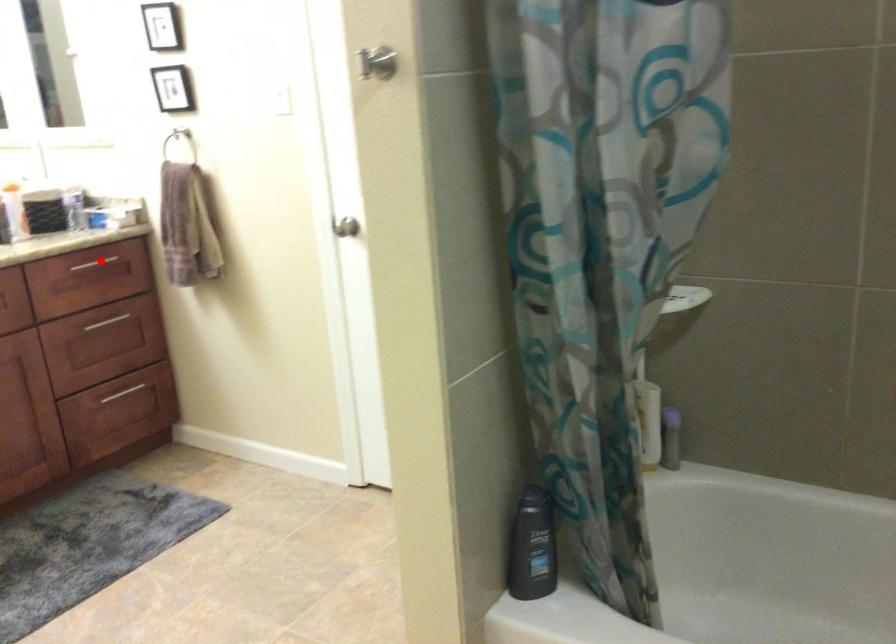
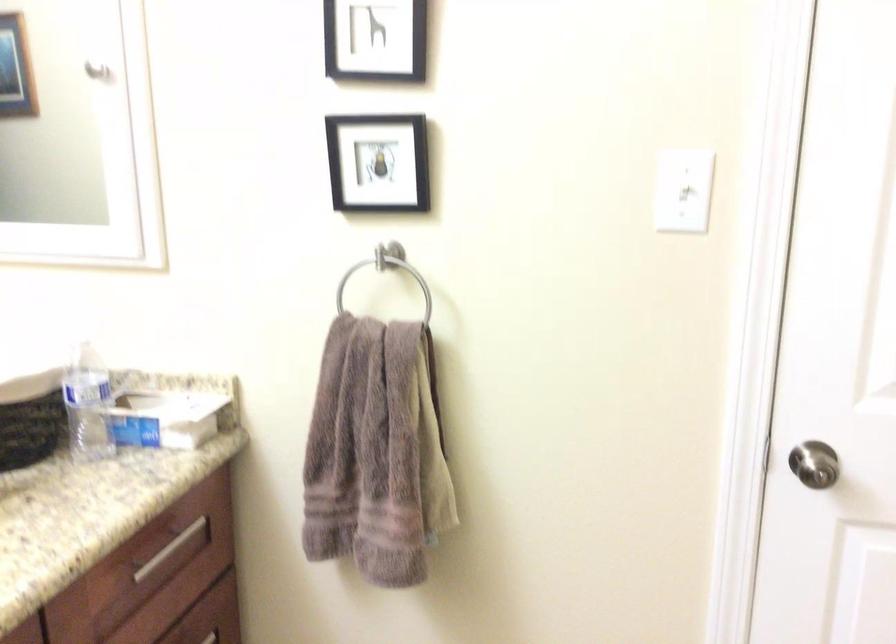
In the second image, find the point that corresponds to the highlighted location in the first image.

(168, 549)